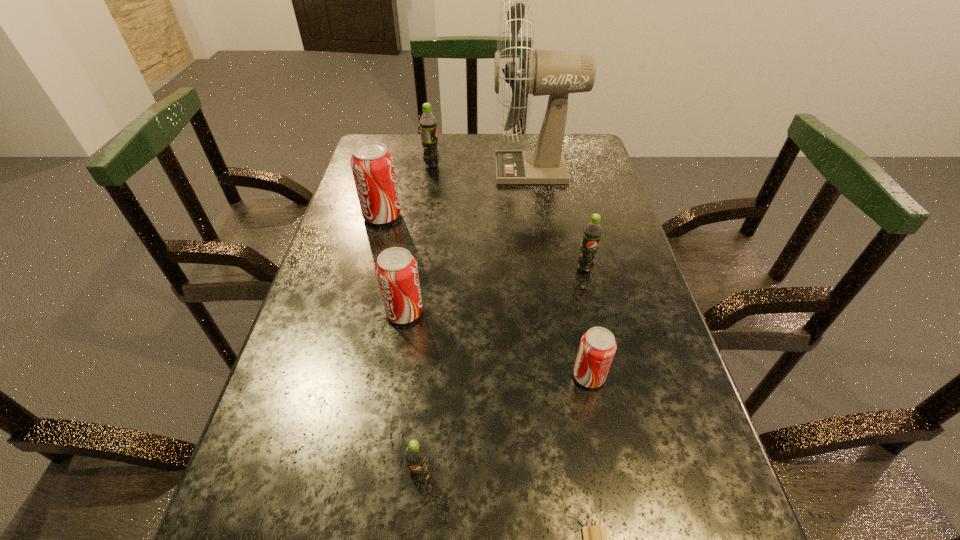
Identify the location of free point located on the front label of the rightmost green soda. The height and width of the screenshot is (540, 960). (618, 410).

The height and width of the screenshot is (540, 960). I want to click on vacant space located on the logo side of the third nearest object, so click(x=536, y=376).

In order to click on vacant space located on the logo side of the third nearest object in this screenshot , I will do `click(387, 376)`.

Find the location of a particular element. The height and width of the screenshot is (540, 960). blank area located on the logo side of the third nearest object is located at coordinates (402, 376).

Locate an element on the screen. free space located on the front label of the second nearest object is located at coordinates (416, 538).

Locate an element on the screen. This screenshot has width=960, height=540. fan positioned at the far edge is located at coordinates (555, 73).

At what (x,y) coordinates should I click in order to perform the action: click on soda present at the far edge. Please return your answer as a coordinate pair (x, y). The width and height of the screenshot is (960, 540). Looking at the image, I should click on (428, 123).

Where is `object at the left edge`? This screenshot has height=540, width=960. object at the left edge is located at coordinates (372, 165).

Find the location of a particular element. The image size is (960, 540). fan that is at the right edge is located at coordinates (555, 73).

Where is `object located at the far right corner`? This screenshot has width=960, height=540. object located at the far right corner is located at coordinates (555, 73).